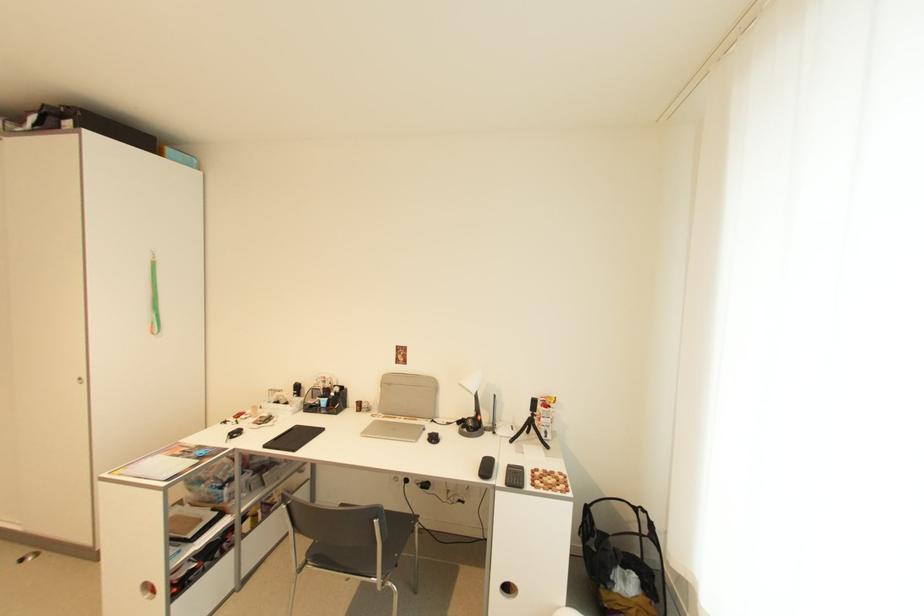
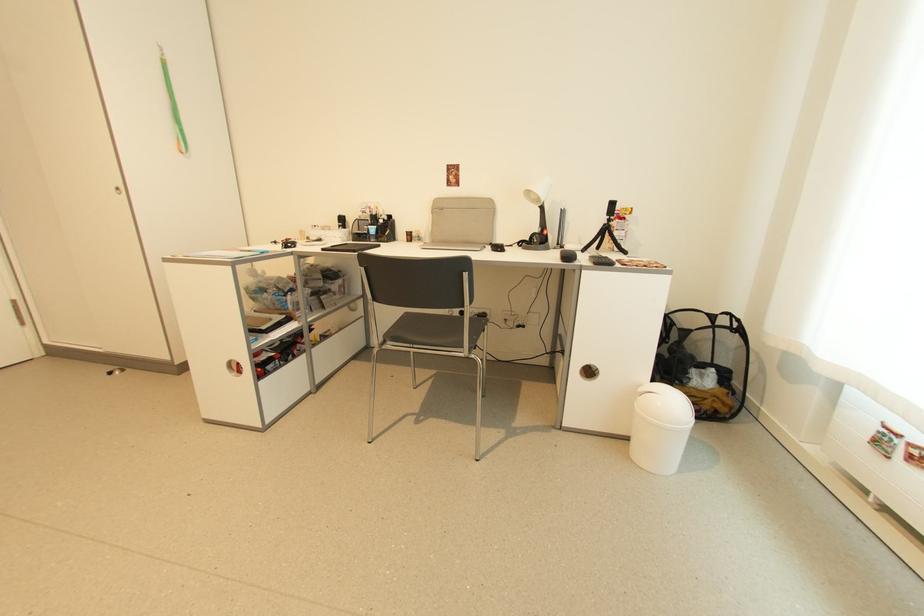
In the second image, find the point that corresponds to the point at 477,416 in the first image.

(541, 232)